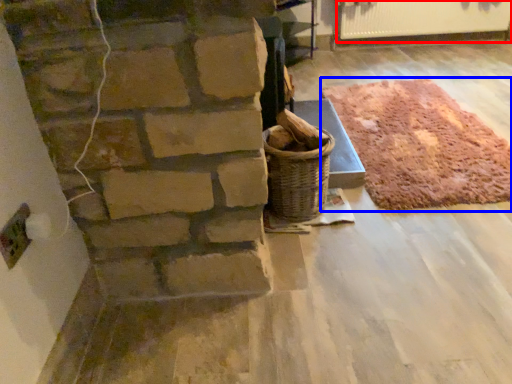
Question: Which point is closer to the camera, radiator (highlighted by a red box) or mat (highlighted by a blue box)?

Choices:
 (A) radiator
 (B) mat

Answer: (B)